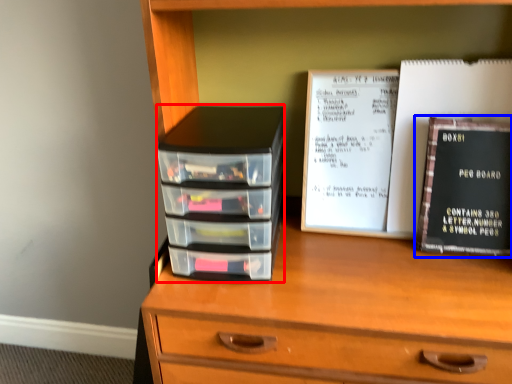
Question: Which object is further to the camera taking this photo, stack (highlighted by a red box) or book (highlighted by a blue box)?

Choices:
 (A) stack
 (B) book

Answer: (B)